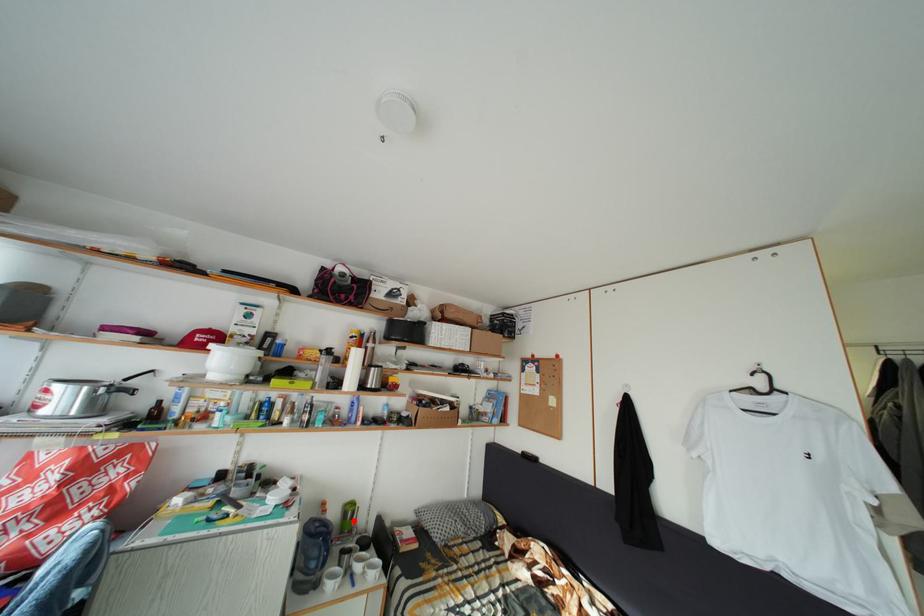
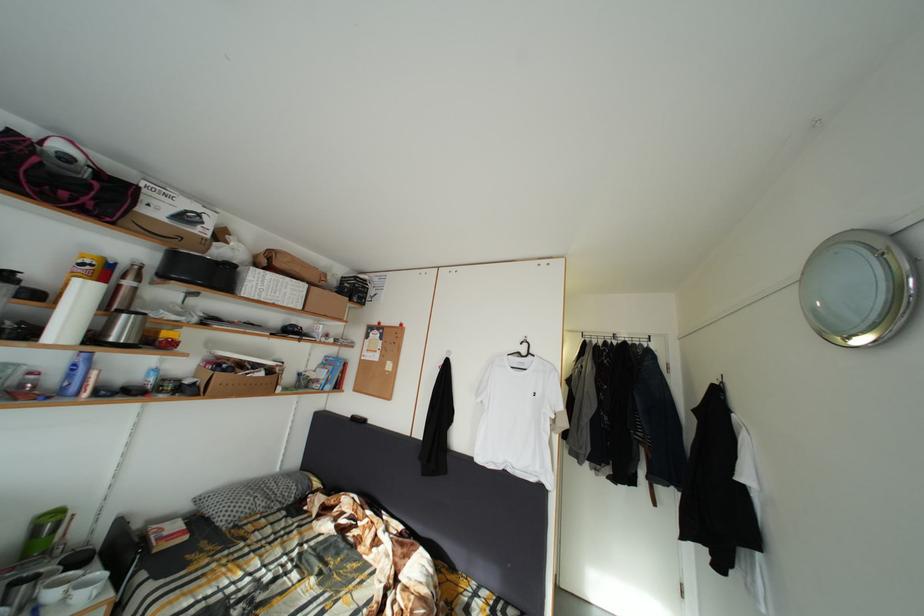
In the second image, find the point that corresponds to the highlighted location in the first image.

(44, 537)